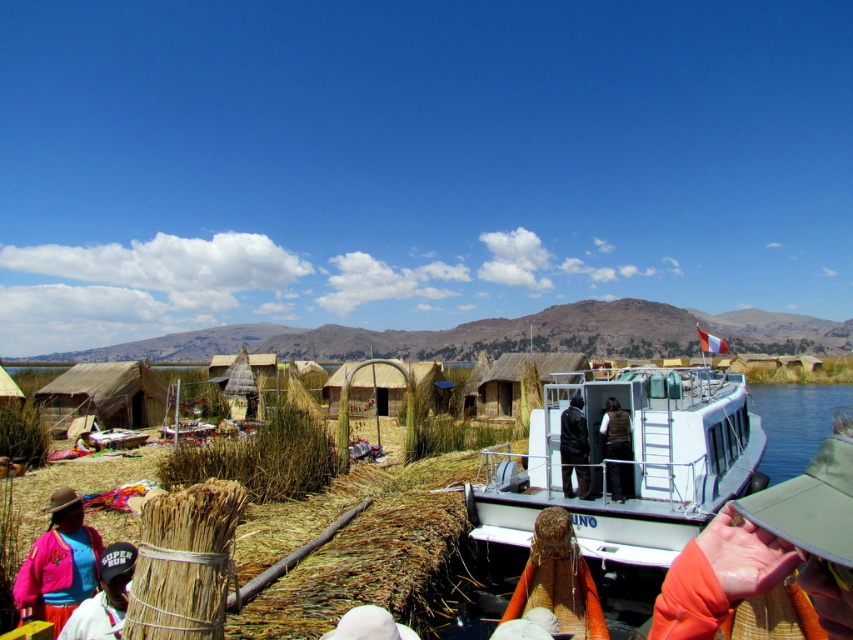
You are standing in the floating village and want to take a photo of the brown leather vest at center and the white matte boat at center. Which object should you aim your camera at first if you want to capture both in one frame without moving the camera?

You should aim your camera at the brown leather vest at center first because the white matte boat at center is to the right of it, so by centering the vest, the boat will naturally be included to the right in the frame.

You are a photographer standing in the floating village and notice the orange fabric at lower right and the black leather jacket at center. Which item is covering the other?

The orange fabric at lower right is positioned over the black leather jacket at center, so it is covering it.